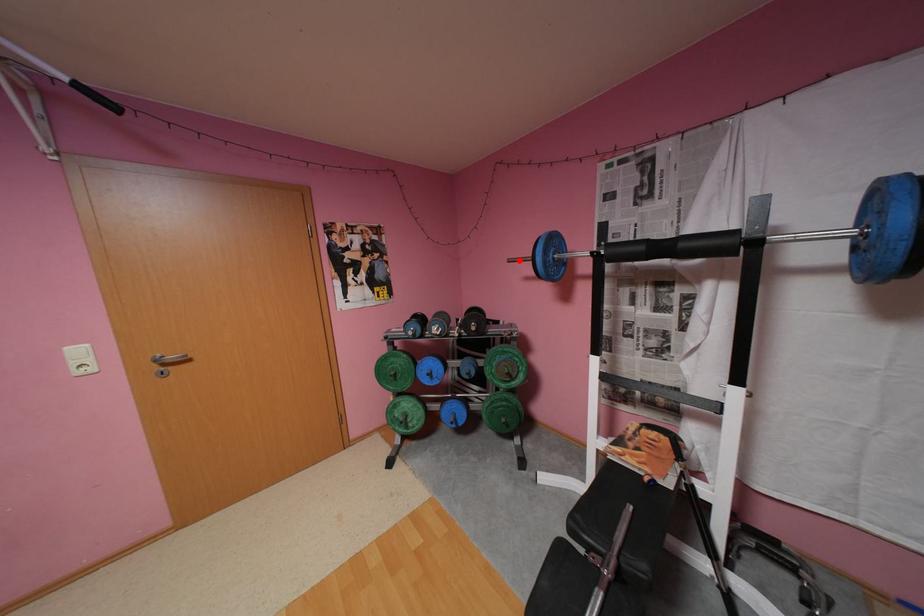
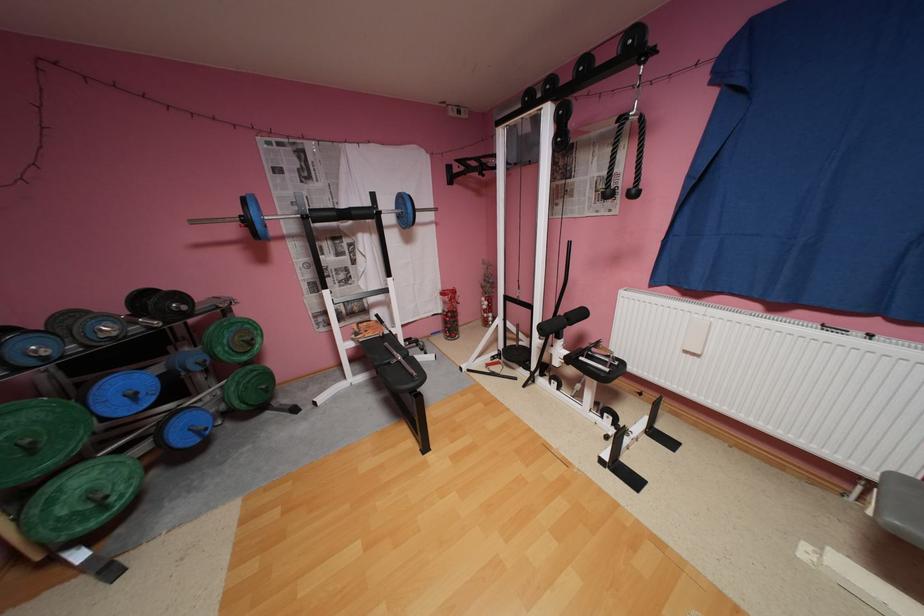
Find the pixel in the second image that matches the highlighted location in the first image.

(202, 223)